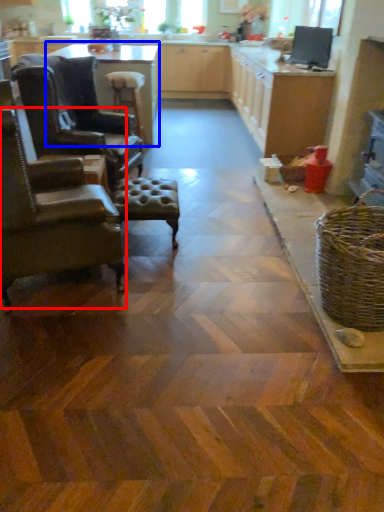
Question: Which of the following is the farthest to the observer, chair (highlighted by a red box) or table (highlighted by a blue box)?

Choices:
 (A) chair
 (B) table

Answer: (B)